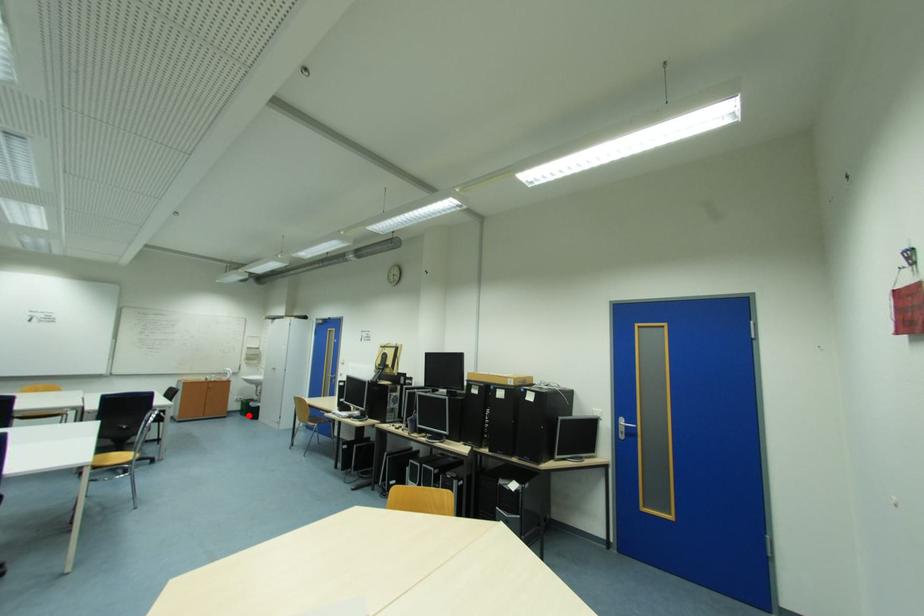
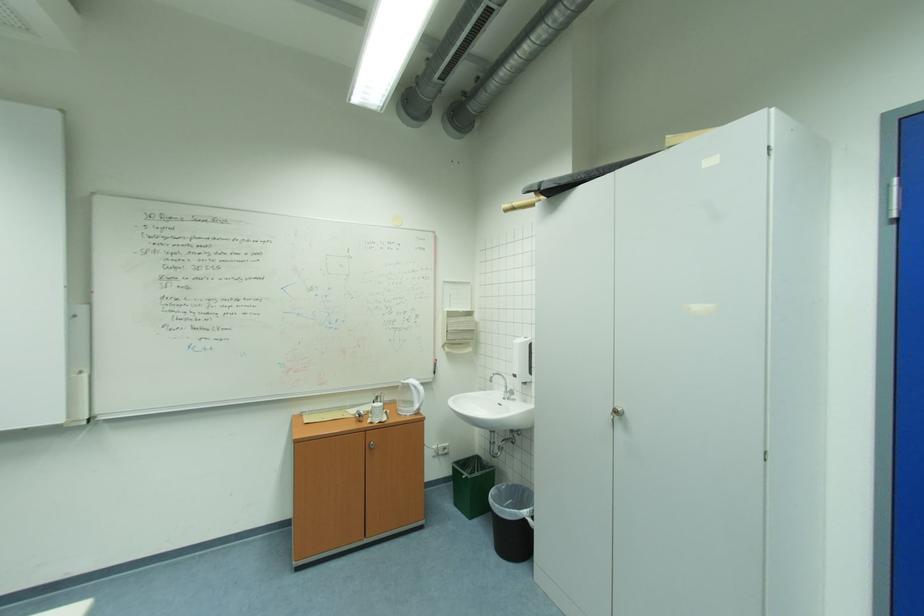
Locate, in the second image, the point that corresponds to the highlighted location in the first image.

(464, 505)